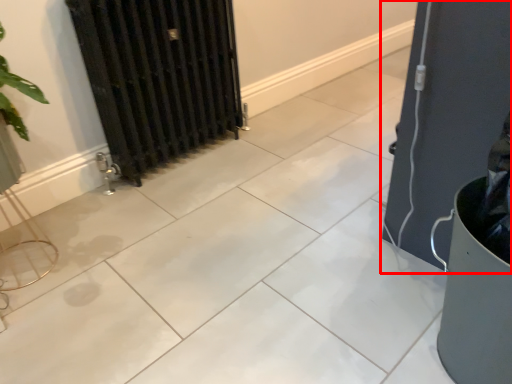
Question: Where is door (annotated by the red box) located in relation to radiator in the image?

Choices:
 (A) left
 (B) right

Answer: (B)